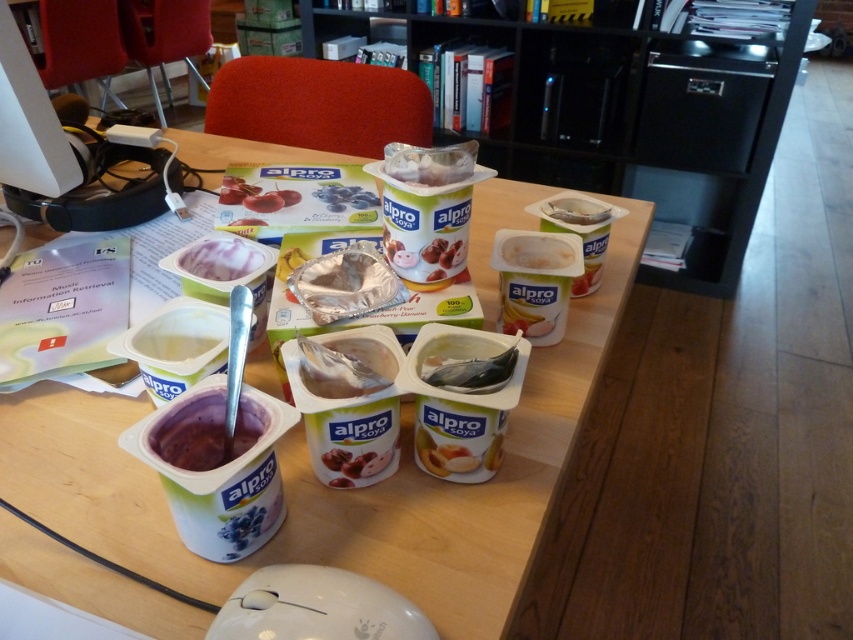
Which is behind, point (564, 216) or point (339, 188)?

The point (339, 188) is behind.

Between white plastic container at upper right and matte plastic yogurt cup at center, which one has more height?

matte plastic yogurt cup at center

Measure the distance between point (566, 209) and camera.

Point (566, 209) is 35.34 inches from camera.

Image resolution: width=853 pixels, height=640 pixels. In order to click on white plastic container at upper right in this screenshot , I will do `click(576, 211)`.

Find the location of a particular element. white plastic table at center is located at coordinates (332, 488).

Can you confirm if white plastic table at center is positioned to the right of translucent plastic fish at center?

Incorrect, white plastic table at center is not on the right side of translucent plastic fish at center.

Who is more forward, [503,596] or [457,384]?

Point [503,596] is in front.

The width and height of the screenshot is (853, 640). I want to click on white plastic table at center, so click(x=332, y=488).

Does purple matte yogurt at lower left have a lesser width compared to matte plastic yogurt cup at center?

Yes, purple matte yogurt at lower left is thinner than matte plastic yogurt cup at center.

Can you confirm if purple matte yogurt at lower left is wider than matte plastic yogurt cup at center?

In fact, purple matte yogurt at lower left might be narrower than matte plastic yogurt cup at center.

Which is in front, point (218, 394) or point (352, 189)?

Positioned in front is point (218, 394).

Where is `purple matte yogurt at lower left`? The width and height of the screenshot is (853, 640). purple matte yogurt at lower left is located at coordinates point(207,432).